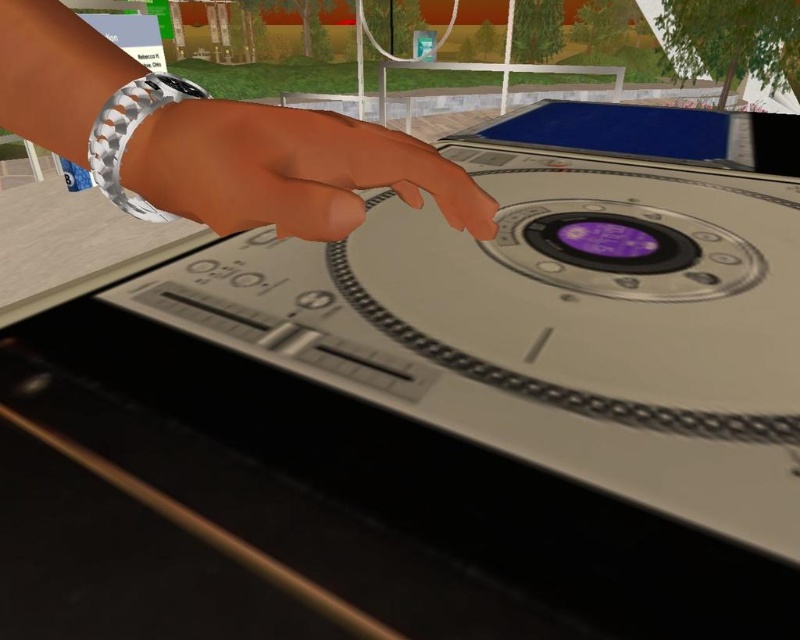
Between silver metallic watch at upper left and satin silver wristwatch at center, which one has more height?

silver metallic watch at upper left

Who is shorter, silver metallic watch at upper left or satin silver wristwatch at center?

Standing shorter between the two is satin silver wristwatch at center.

Where is `silver metallic watch at upper left`? silver metallic watch at upper left is located at coordinates [x=208, y=140].